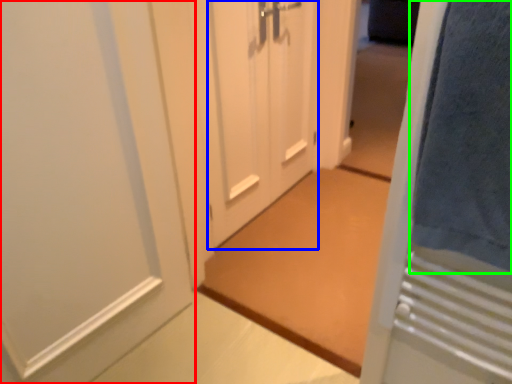
Question: Based on their relative distances, which object is nearer to door (highlighted by a red box)? Choose from door (highlighted by a blue box) and bath towel (highlighted by a green box).

Choices:
 (A) door
 (B) bath towel

Answer: (A)